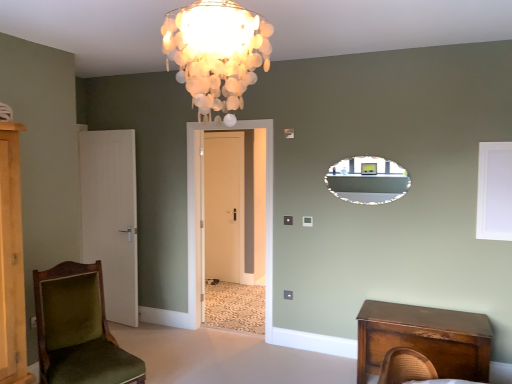
Find the location of `empty space that is in between wooden nightstand at lower right and white matte door at left, which is the third door from right to left`. empty space that is in between wooden nightstand at lower right and white matte door at left, which is the third door from right to left is located at coordinates (252, 348).